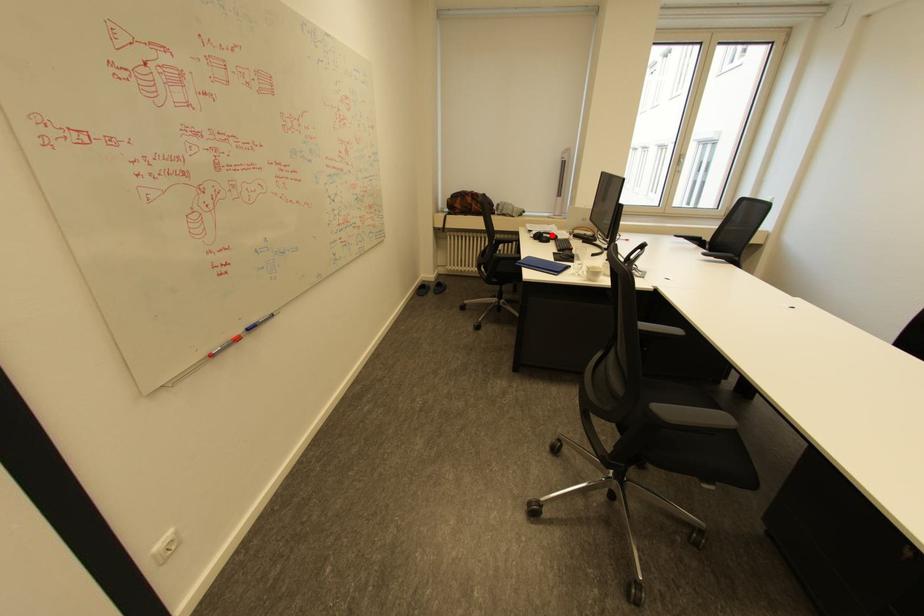
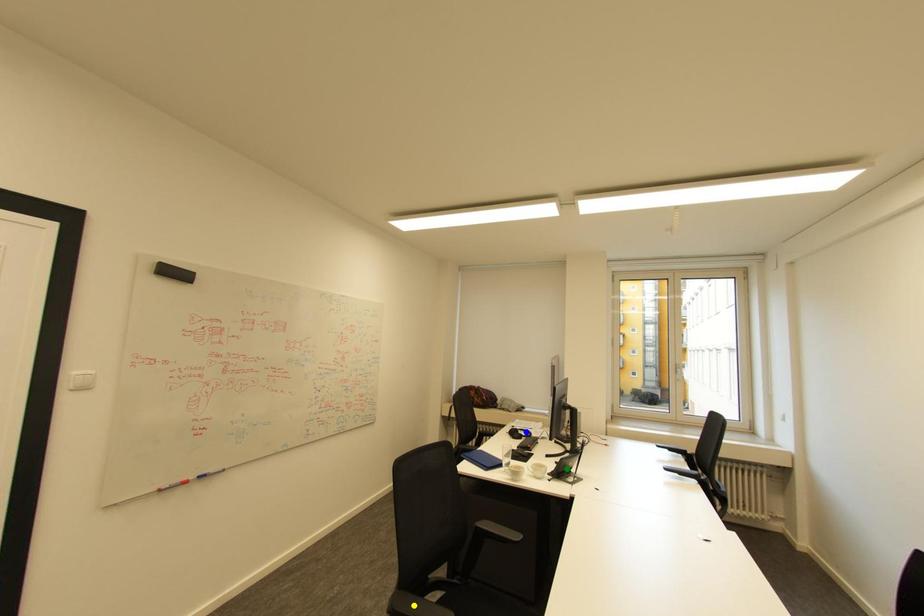
Question: I am providing you with two images of the same scene from different viewpoints. A red point is marked on the first image. You are given multiple points on the second image. Which mark in image 2 goes with the point in image 1?

Choices:
 (A) green point
 (B) yellow point
 (C) blue point

Answer: (C)